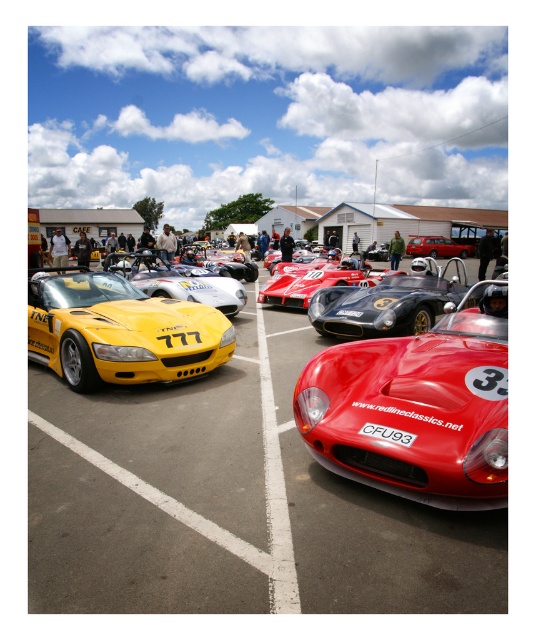
Question: Does shiny yellow car at left appear over yellow matte sports car at center?

Choices:
 (A) no
 (B) yes

Answer: (A)

Question: Which of the following is the farthest from the observer?

Choices:
 (A) shiny yellow car at left
 (B) shiny yellow sports car at left
 (C) shiny black race car at center

Answer: (C)

Question: Considering the real-world distances, which object is closest to the yellow matte sports car at center?

Choices:
 (A) shiny black race car at center
 (B) shiny metallic race car at center

Answer: (B)

Question: Observing the image, what is the correct spatial positioning of shiny black race car at center in reference to metallic silver sports car at center?

Choices:
 (A) left
 (B) right

Answer: (A)

Question: Among these points, which one is nearest to the camera?

Choices:
 (A) (273, 282)
 (B) (212, 321)
 (C) (360, 433)
 (D) (76, 448)

Answer: (C)

Question: Is shiny metallic race car at center behind metallic silver sports car at center?

Choices:
 (A) yes
 (B) no

Answer: (B)